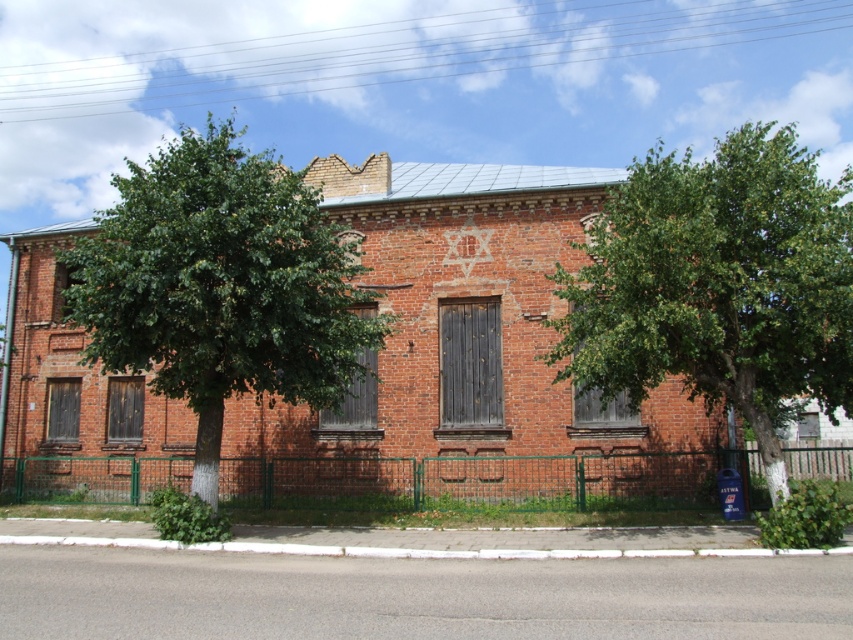
Question: Is green leafy tree at right further to camera compared to green leafy tree at left?

Choices:
 (A) yes
 (B) no

Answer: (B)

Question: Among these points, which one is nearest to the camera?

Choices:
 (A) (219, 180)
 (B) (637, 273)

Answer: (B)

Question: Does green leafy tree at right appear under green leafy tree at left?

Choices:
 (A) no
 (B) yes

Answer: (A)

Question: From the image, what is the correct spatial relationship of green leafy tree at right in relation to green leafy tree at left?

Choices:
 (A) left
 (B) right

Answer: (B)